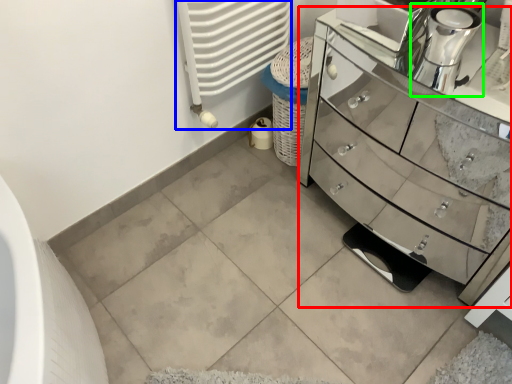
Question: Estimate the real-world distances between objects in this image. Which object is closer to chest of drawers (highlighted by a red box), radiator (highlighted by a blue box) or coffee machine (highlighted by a green box)?

Choices:
 (A) radiator
 (B) coffee machine

Answer: (A)